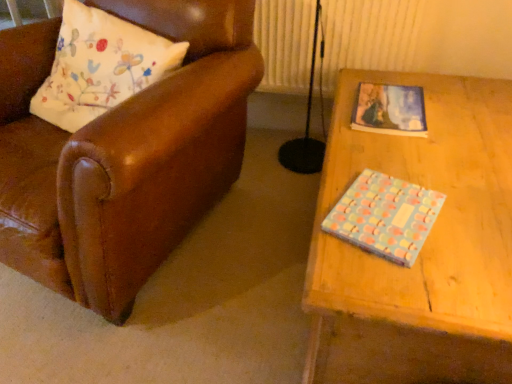
Question: Does pastel-patterned paper at upper right, arranged as the 1th book when viewed from the back, have a lesser height compared to pastel polka dot book at right, positioned as the first book in front-to-back order?

Choices:
 (A) yes
 (B) no

Answer: (A)

Question: Is pastel-patterned paper at upper right, arranged as the 1th book when viewed from the back, turned away from pastel polka dot book at right, positioned as the first book in front-to-back order?

Choices:
 (A) yes
 (B) no

Answer: (B)

Question: From the image's perspective, would you say pastel-patterned paper at upper right, the 2th book in the front-to-back sequence, is shown under pastel polka dot book at right, positioned as the first book in front-to-back order?

Choices:
 (A) no
 (B) yes

Answer: (A)

Question: From the image's perspective, is pastel-patterned paper at upper right, arranged as the 1th book when viewed from the back, above pastel polka dot book at right, positioned as the first book in front-to-back order?

Choices:
 (A) yes
 (B) no

Answer: (A)

Question: Does pastel-patterned paper at upper right, which is the second book from bottom to top, turn towards pastel polka dot book at right, the first book positioned from the bottom?

Choices:
 (A) no
 (B) yes

Answer: (A)

Question: Is leather pillow at left to the left or to the right of pastel-patterned paper at upper right, the 2th book in the front-to-back sequence, in the image?

Choices:
 (A) right
 (B) left

Answer: (B)

Question: Considering the positions of point (151, 34) and point (386, 114), is point (151, 34) closer or farther from the camera than point (386, 114)?

Choices:
 (A) closer
 (B) farther

Answer: (B)

Question: From a real-world perspective, relative to pastel-patterned paper at upper right, the 2th book in the front-to-back sequence, is leather pillow at left vertically above or below?

Choices:
 (A) below
 (B) above

Answer: (B)

Question: Looking at the image, does leather pillow at left seem bigger or smaller compared to pastel-patterned paper at upper right, the 2th book in the front-to-back sequence?

Choices:
 (A) big
 (B) small

Answer: (A)

Question: Is point (418, 125) closer or farther from the camera than point (365, 168)?

Choices:
 (A) closer
 (B) farther

Answer: (B)

Question: Based on their sizes in the image, would you say pastel-patterned paper at upper right, the 2th book in the front-to-back sequence, is bigger or smaller than pastel polka dot book at right, which is the second book from top to bottom?

Choices:
 (A) small
 (B) big

Answer: (B)

Question: In the image, is pastel-patterned paper at upper right, which is the second book from bottom to top, on the left side or the right side of pastel polka dot book at right, the second book from the back?

Choices:
 (A) right
 (B) left

Answer: (A)

Question: Do you think pastel-patterned paper at upper right, the 2th book in the front-to-back sequence, is within pastel polka dot book at right, the first book positioned from the bottom, or outside of it?

Choices:
 (A) inside
 (B) outside

Answer: (B)

Question: Do you think pastel polka dot book at right, which is the second book from top to bottom, is within pastel-patterned paper at upper right, which is the second book from bottom to top, or outside of it?

Choices:
 (A) outside
 (B) inside

Answer: (A)

Question: Is pastel polka dot book at right, the first book positioned from the bottom, taller or shorter than pastel-patterned paper at upper right, which is the second book from bottom to top?

Choices:
 (A) short
 (B) tall

Answer: (B)